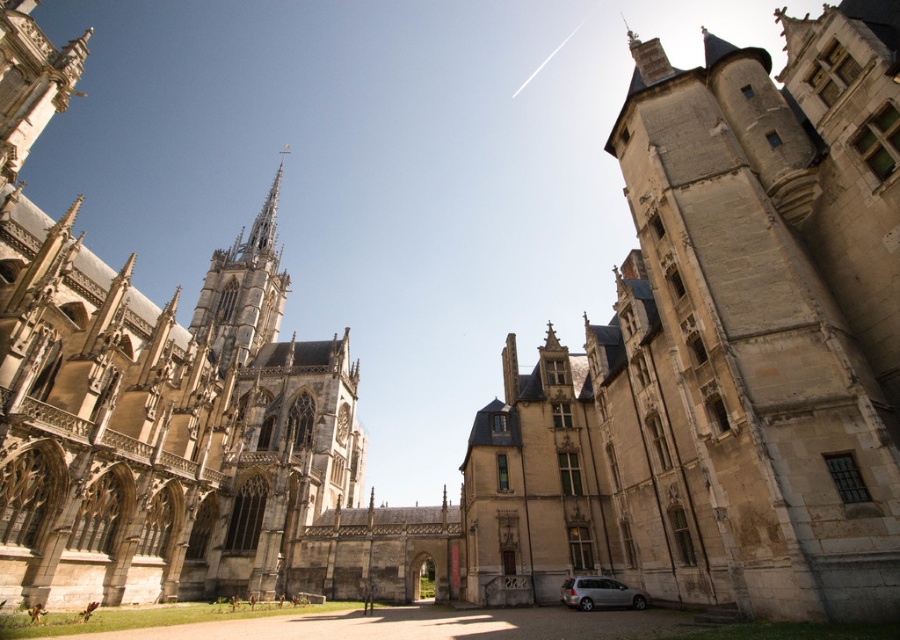
You are an architect planning to install a large clock tower that needs to be taller than both the stone castle at center and the stone gothic cathedral at left. Based on the current heights, is this achievable?

The stone gothic cathedral at left is taller than the stone castle at center. Since the clock tower needs to be taller than both, it must exceed the height of the stone gothic cathedral at left, which is the taller of the two.

You are standing in the courtyard between the stone castle at center and the stone gothic cathedral at left. If you look towards the cathedral, which building will block your view of the cathedral?

The stone castle at center is in front of the stone gothic cathedral at left, so it will block your view of the cathedral.

You are an architect planning to install a new flagpole on the tallest structure in the image. Which structure should you choose between the stone castle at center and the stone spire at upper left?

The stone castle at center is much taller than the stone spire at upper left, so you should install the flagpole on the stone castle at center.